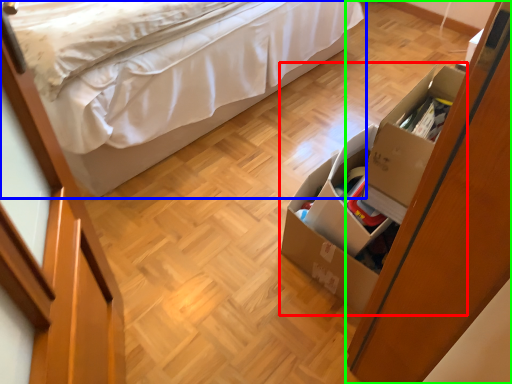
Question: Which is farther away from storage box (highlighted by a red box)? bed (highlighted by a blue box) or dresser (highlighted by a green box)?

Choices:
 (A) bed
 (B) dresser

Answer: (A)